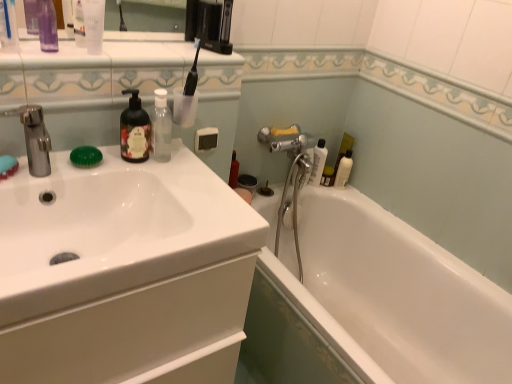
Question: From the image's perspective, is clear plastic bottle at upper left, positioned as the 1th mouthwash in left-to-right order, positioned above or below transparent plastic bottle at upper center, the 1th mouthwash from the bottom?

Choices:
 (A) below
 (B) above

Answer: (B)

Question: In the image, is clear plastic bottle at upper left, marked as the second mouthwash in a bottom-to-top arrangement, on the left side or the right side of transparent plastic bottle at upper center, the 1th mouthwash when ordered from right to left?

Choices:
 (A) right
 (B) left

Answer: (B)

Question: Which is nearer to the transparent plastic bottle at upper center, the 1th mouthwash from the bottom?

Choices:
 (A) white glossy bathtub at lower right
 (B) white glossy bottle at upper right, which is counted as the third toiletry, starting from the front
 (C) matte black soap dispenser at upper left
 (D) white glossy bottle at right, which is the first toiletry in back-to-front order
 (E) green translucent soap at left

Answer: (C)

Question: Estimate the real-world distances between objects in this image. Which object is closer to the transparent plastic bottle at upper left, positioned as the 1th toiletry in left-to-right order?

Choices:
 (A) white glossy bathtub at lower right
 (B) green translucent soap at left
 (C) transparent plastic bottle at upper left, marked as the 2th toiletry in a left-to-right arrangement
 (D) matte black soap dispenser at upper left
 (E) transparent plastic bottle at upper center, the 2th mouthwash when ordered from top to bottom

Answer: (C)